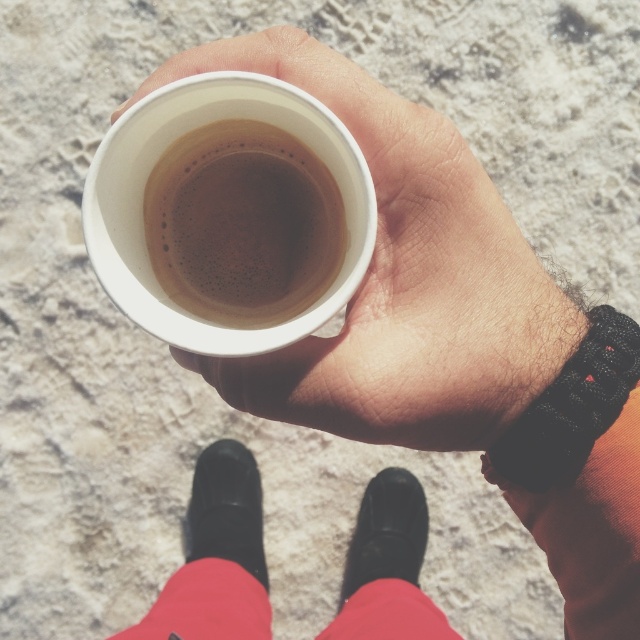
Between black knitted sock at lower right and black leather boot at lower center, which one appears on the right side from the viewer's perspective?

black knitted sock at lower right is more to the right.

Does black knitted sock at lower right appear under black leather boot at lower center?

Actually, black knitted sock at lower right is above black leather boot at lower center.

Between point (486, 452) and point (205, 552), which one is positioned in front?

Point (486, 452) is more forward.

Image resolution: width=640 pixels, height=640 pixels. What are the coordinates of `black knitted sock at lower right` in the screenshot? It's located at (572, 406).

Who is positioned more to the left, white matte cup at center or red cotton sock at lower center?

red cotton sock at lower center is more to the left.

Who is more distant from viewer, (x=390, y=164) or (x=266, y=620)?

Positioned behind is point (x=266, y=620).

I want to click on white matte cup at center, so click(401, 276).

Does white matte cup at center have a greater height compared to black knitted sock at lower right?

Indeed, white matte cup at center has a greater height compared to black knitted sock at lower right.

Which is behind, point (518, 342) or point (515, 422)?

Point (515, 422)

Does point (449, 289) lie in front of point (509, 474)?

No, it is behind (509, 474).

You are a GUI agent. You are given a task and a screenshot of the screen. Output one action in this format:
    pyautogui.click(x=<x>, y=<y>)
    Task: Click on the white matte cup at center
    
    Given the screenshot: What is the action you would take?
    point(401,276)